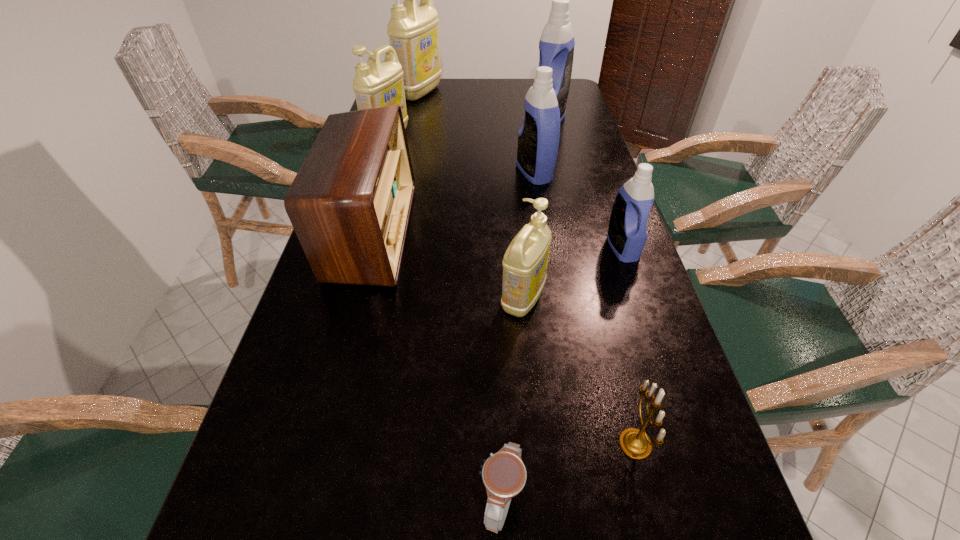
The height and width of the screenshot is (540, 960). What are the coordinates of `the farthest object` in the screenshot? It's located at (413, 31).

In order to click on the farthest detergent in this screenshot , I will do `click(413, 31)`.

I want to click on the farthest blue detergent, so click(x=556, y=46).

Where is `the second biggest beige detergent`? the second biggest beige detergent is located at coordinates (376, 84).

Locate an element on the screen. The height and width of the screenshot is (540, 960). the second nearest blue detergent is located at coordinates (538, 139).

I want to click on the third nearest detergent, so click(x=538, y=139).

The width and height of the screenshot is (960, 540). In order to click on radio receiver in this screenshot , I will do `click(350, 203)`.

Locate an element on the screen. Image resolution: width=960 pixels, height=540 pixels. the nearest detergent is located at coordinates (525, 261).

The height and width of the screenshot is (540, 960). What are the coordinates of `the rightmost beige detergent` in the screenshot? It's located at (525, 261).

You are a GUI agent. You are given a task and a screenshot of the screen. Output one action in this format:
    pyautogui.click(x=<x>, y=<y>)
    Task: Click on the second nearest detergent
    This screenshot has height=540, width=960.
    Given the screenshot: What is the action you would take?
    pyautogui.click(x=627, y=234)